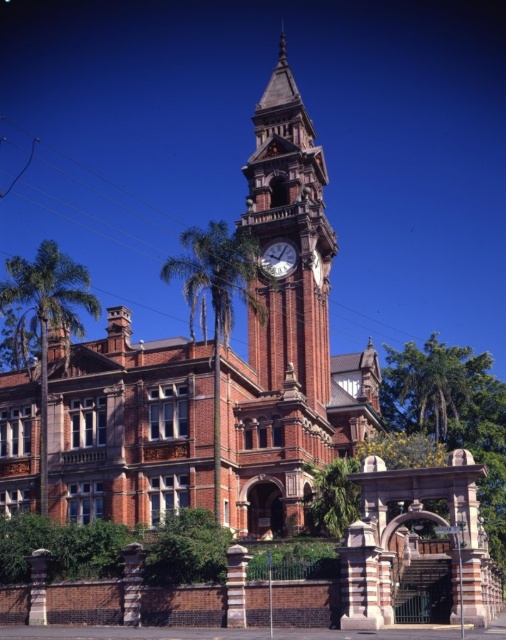
You are an architect planning to install a new lighting system for the red brick clock tower at center and the green leafy palm tree at left. Based on their sizes, which object requires more lights to fully illuminate?

The green leafy palm tree at left requires more lights to fully illuminate because it is larger in size compared to the red brick clock tower at center.

You are standing at the entrance of the historic building and want to take a photo of the red brick clock tower at center. If you are facing the building, which direction should you position yourself relative to the tower to capture it in the frame?

Since the red brick clock tower at center is located at point coordinates, you should position yourself directly in front of the tower to capture it in the frame as it is centrally positioned on the building.